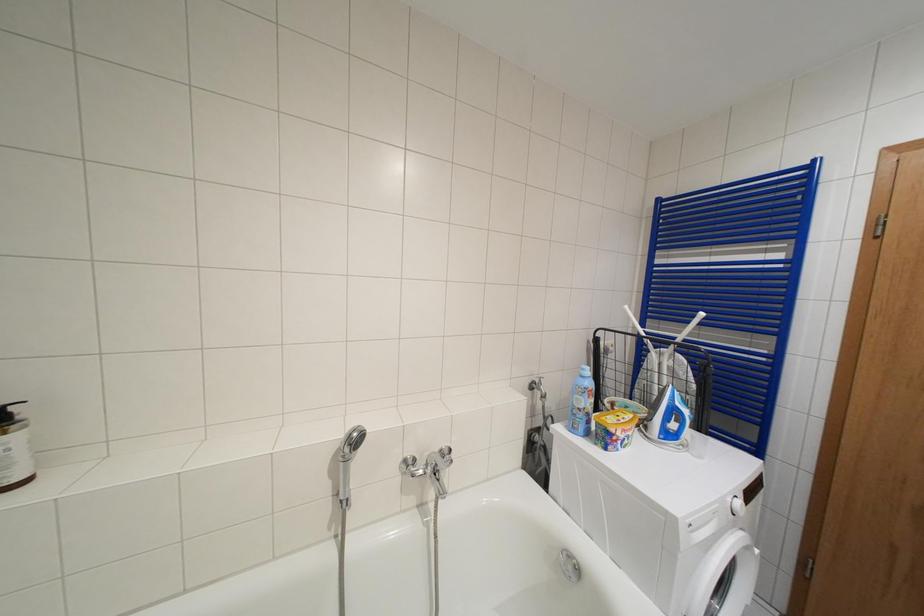
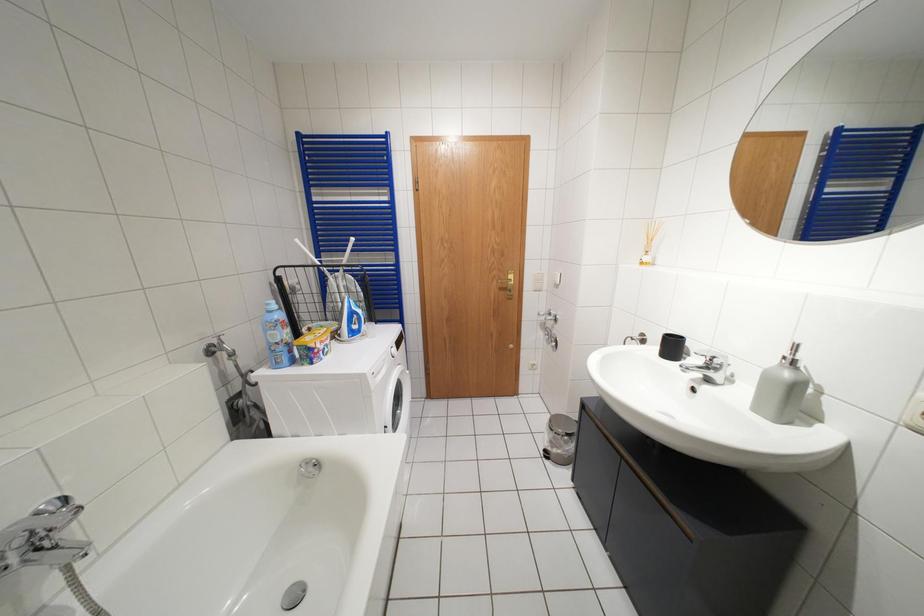
First-person continuous shooting, in which direction is the camera rotating?

The rotation direction of the camera is right-down.